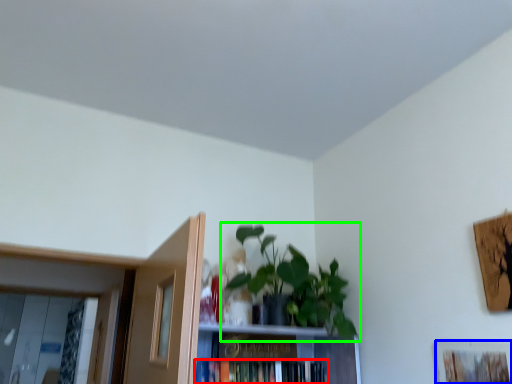
Question: Which is nearer to the book (highlighted by a red box)? picture frame (highlighted by a blue box) or houseplant (highlighted by a green box).

Choices:
 (A) picture frame
 (B) houseplant

Answer: (B)